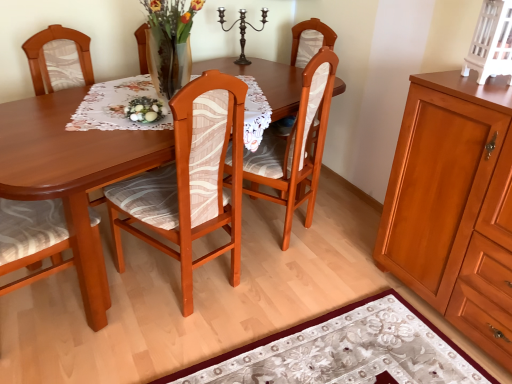
Question: Does white painted wood cabinet at upper right, the second cabinetry ordered from the bottom, appear on the right side of dark brown metal candle holder at upper center?

Choices:
 (A) no
 (B) yes

Answer: (B)

Question: Is white painted wood cabinet at upper right, the second cabinetry ordered from the bottom, positioned in front of dark brown metal candle holder at upper center?

Choices:
 (A) yes
 (B) no

Answer: (A)

Question: From the image's perspective, is white painted wood cabinet at upper right, the first cabinetry in the top-to-bottom sequence, on top of dark brown metal candle holder at upper center?

Choices:
 (A) yes
 (B) no

Answer: (B)

Question: Is white painted wood cabinet at upper right, the first cabinetry in the top-to-bottom sequence, oriented away from dark brown metal candle holder at upper center?

Choices:
 (A) yes
 (B) no

Answer: (B)

Question: Is white painted wood cabinet at upper right, the second cabinetry ordered from the bottom, positioned far away from dark brown metal candle holder at upper center?

Choices:
 (A) yes
 (B) no

Answer: (A)

Question: Considering the relative sizes of white painted wood cabinet at upper right, the first cabinetry in the top-to-bottom sequence, and dark brown metal candle holder at upper center in the image provided, is white painted wood cabinet at upper right, the first cabinetry in the top-to-bottom sequence, shorter than dark brown metal candle holder at upper center?

Choices:
 (A) no
 (B) yes

Answer: (B)

Question: Does floral-patterned fabric at lower center lie in front of matte wood cabinet at right, placed as the second cabinetry when sorted from top to bottom?

Choices:
 (A) no
 (B) yes

Answer: (A)

Question: Can you see floral-patterned fabric at lower center touching matte wood cabinet at right, the first cabinetry in the bottom-to-top sequence?

Choices:
 (A) no
 (B) yes

Answer: (A)

Question: From a real-world perspective, is floral-patterned fabric at lower center positioned over matte wood cabinet at right, the first cabinetry in the bottom-to-top sequence, based on gravity?

Choices:
 (A) no
 (B) yes

Answer: (A)

Question: From the image's perspective, is floral-patterned fabric at lower center located beneath matte wood cabinet at right, the first cabinetry in the bottom-to-top sequence?

Choices:
 (A) yes
 (B) no

Answer: (A)

Question: Is floral-patterned fabric at lower center taller than matte wood cabinet at right, placed as the second cabinetry when sorted from top to bottom?

Choices:
 (A) no
 (B) yes

Answer: (A)

Question: Considering the relative sizes of floral-patterned fabric at lower center and matte wood cabinet at right, placed as the second cabinetry when sorted from top to bottom, in the image provided, is floral-patterned fabric at lower center smaller than matte wood cabinet at right, placed as the second cabinetry when sorted from top to bottom,?

Choices:
 (A) yes
 (B) no

Answer: (A)

Question: Would you say wooden chair at center, which is the 1th chair in left-to-right order, contains matte wood cabinet at right, placed as the second cabinetry when sorted from top to bottom?

Choices:
 (A) yes
 (B) no

Answer: (B)